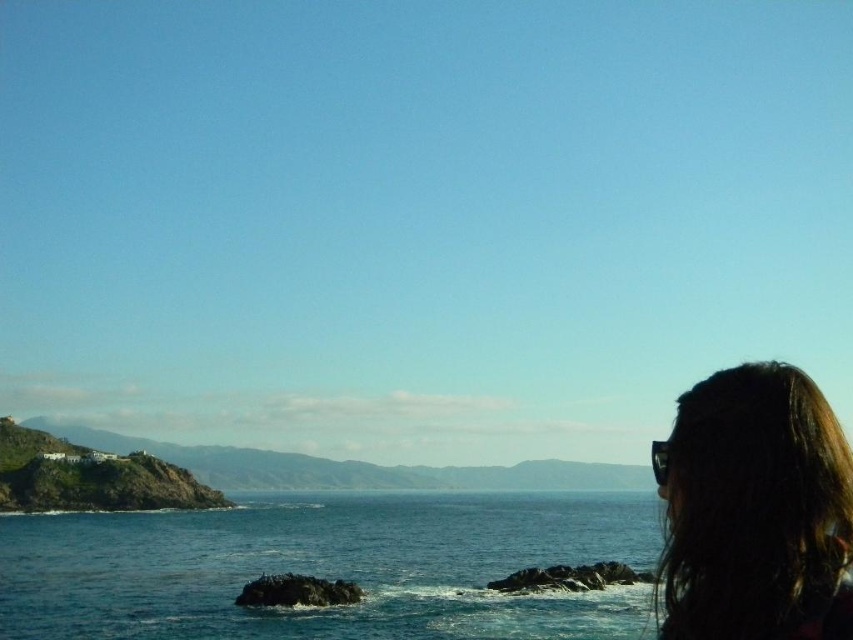
Question: Is blue water at center to the left of dark hair at upper right from the viewer's perspective?

Choices:
 (A) yes
 (B) no

Answer: (A)

Question: Is blue water at center positioned at the back of dark hair at upper right?

Choices:
 (A) yes
 (B) no

Answer: (A)

Question: Does blue water at center lie behind dark hair at upper right?

Choices:
 (A) no
 (B) yes

Answer: (B)

Question: Which point appears closest to the camera in this image?

Choices:
 (A) (776, 435)
 (B) (593, 552)

Answer: (A)